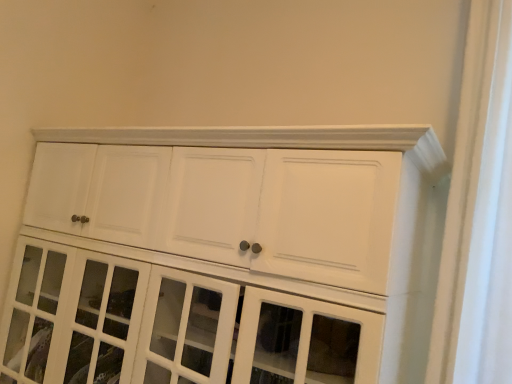
I want to click on white matte cabinet at upper center, so click(x=214, y=253).

Describe the element at coordinates (214, 253) in the screenshot. This screenshot has width=512, height=384. I see `white matte cabinet at upper center` at that location.

You are a GUI agent. You are given a task and a screenshot of the screen. Output one action in this format:
    pyautogui.click(x=<x>, y=<y>)
    Task: Click on the white matte cabinet at upper center
    The height and width of the screenshot is (384, 512).
    Given the screenshot: What is the action you would take?
    pyautogui.click(x=214, y=253)